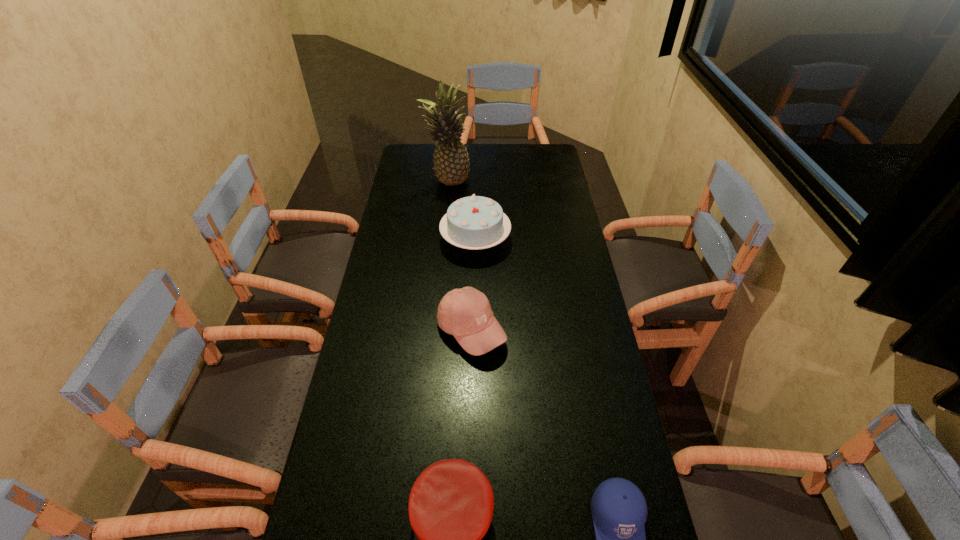
This screenshot has height=540, width=960. In order to click on object that stands as the second closest to the baseball cap in this screenshot , I will do `click(451, 503)`.

Locate an element on the screen. Image resolution: width=960 pixels, height=540 pixels. free space in the image that satisfies the following two spatial constraints: 1. on the front side of the fourth shortest object; 2. on the front-facing side of the third farthest object is located at coordinates (474, 330).